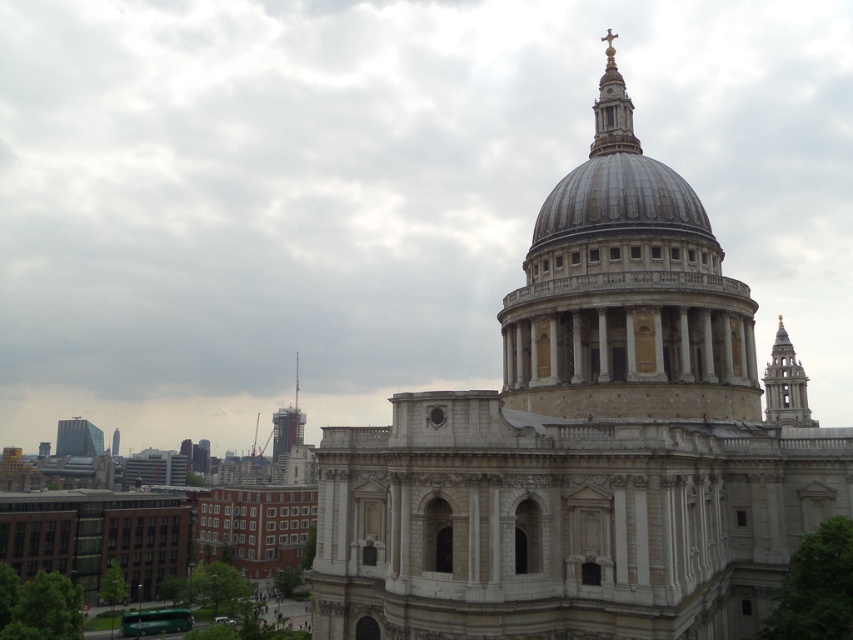
Does gold polished metal cross at upper center have a lesser height compared to glass reflective skyscraper at left?

No, gold polished metal cross at upper center is not shorter than glass reflective skyscraper at left.

This screenshot has width=853, height=640. Identify the location of gold polished metal cross at upper center. (612, 109).

Is white stone cathedral at center to the right of gold textured spire at upper right from the viewer's perspective?

In fact, white stone cathedral at center is to the left of gold textured spire at upper right.

Can you confirm if white stone cathedral at center is taller than gold textured spire at upper right?

Yes.

Where is `white stone cathedral at center`? This screenshot has height=640, width=853. white stone cathedral at center is located at coordinates (583, 449).

Does beige stone dome at center have a lesser height compared to dark gray concrete tower at center?

Incorrect, beige stone dome at center's height does not fall short of dark gray concrete tower at center's.

Does beige stone dome at center have a lesser width compared to dark gray concrete tower at center?

Incorrect, beige stone dome at center's width is not less than dark gray concrete tower at center's.

Find the location of a particular element. beige stone dome at center is located at coordinates (625, 292).

This screenshot has height=640, width=853. What are the coordinates of `beige stone dome at center` in the screenshot? It's located at [x=625, y=292].